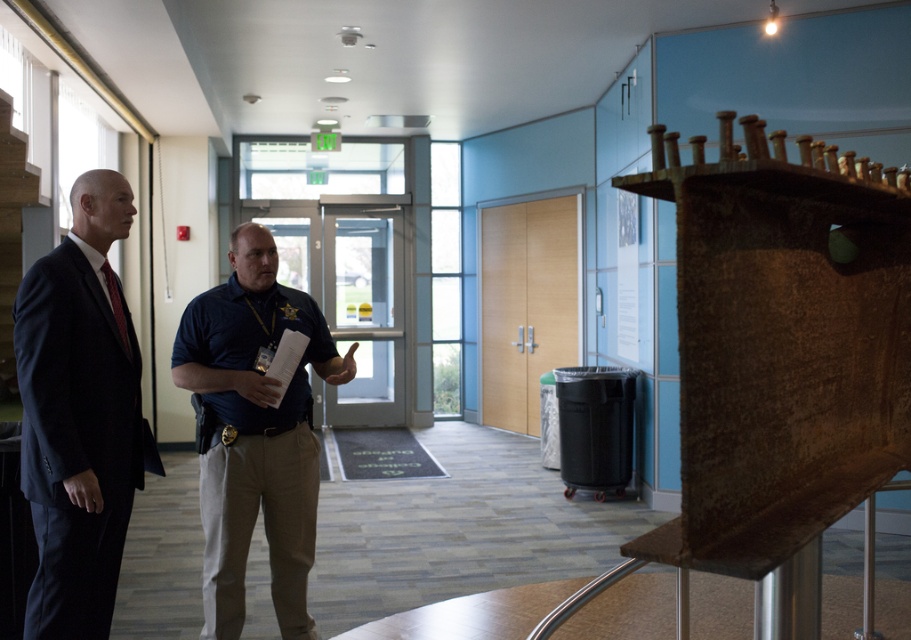
Question: Which object appears closest to the camera in this image?

Choices:
 (A) matte black tie at left
 (B) dark blue uniform at center
 (C) dark blue suit at left

Answer: (C)

Question: In this image, where is dark blue suit at left located relative to matte black tie at left?

Choices:
 (A) below
 (B) above

Answer: (A)

Question: Is dark blue suit at left positioned in front of dark blue uniform at center?

Choices:
 (A) no
 (B) yes

Answer: (B)

Question: Does dark blue uniform at center appear on the right side of matte black tie at left?

Choices:
 (A) yes
 (B) no

Answer: (A)

Question: Which point is closer to the camera taking this photo?

Choices:
 (A) (207, 561)
 (B) (52, 330)

Answer: (B)

Question: Considering the real-world distances, which object is closest to the dark blue suit at left?

Choices:
 (A) matte black tie at left
 (B) dark blue uniform at center

Answer: (A)